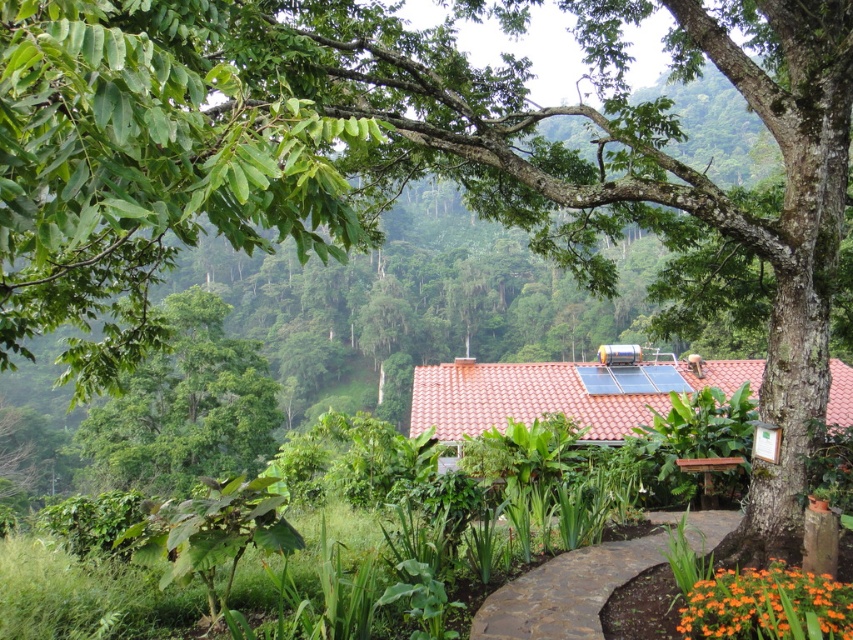
Question: Does orange matte flower at lower right come in front of brown wooden bench at lower right?

Choices:
 (A) yes
 (B) no

Answer: (A)

Question: Does orange matte flower at lower right appear over brown wooden bench at lower right?

Choices:
 (A) yes
 (B) no

Answer: (A)

Question: Can you confirm if orange matte flower at lower right is positioned above brown wooden bench at lower right?

Choices:
 (A) no
 (B) yes

Answer: (B)

Question: Which point appears farthest from the camera in this image?

Choices:
 (A) (827, 624)
 (B) (706, 476)

Answer: (B)